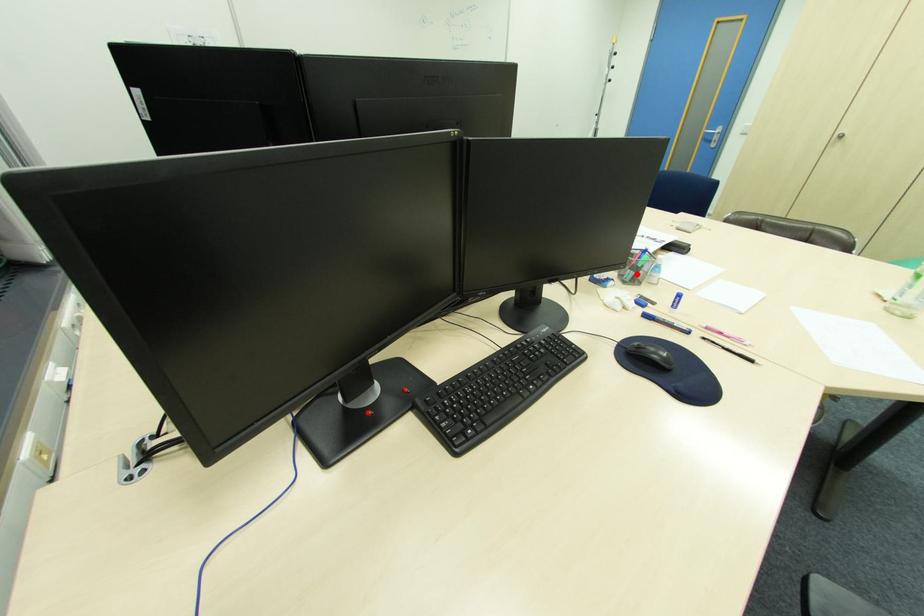
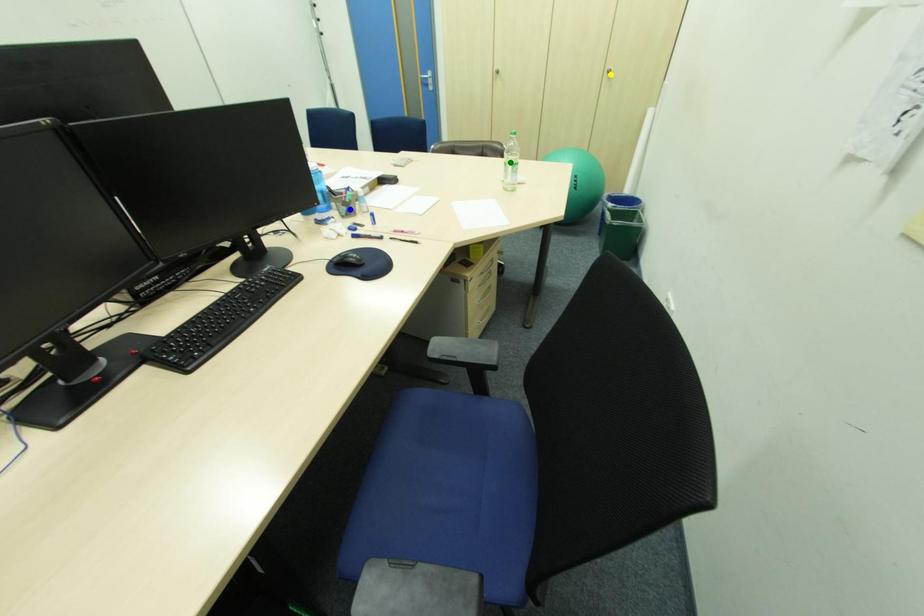
Question: I am providing you with two images of the same scene from different viewpoints. A red point is marked on the first image. You are given multiple points on the second image. Which point in image 2 represents the same 3d spot as the red point in image 1?

Choices:
 (A) green point
 (B) yellow point
 (C) blue point

Answer: (C)